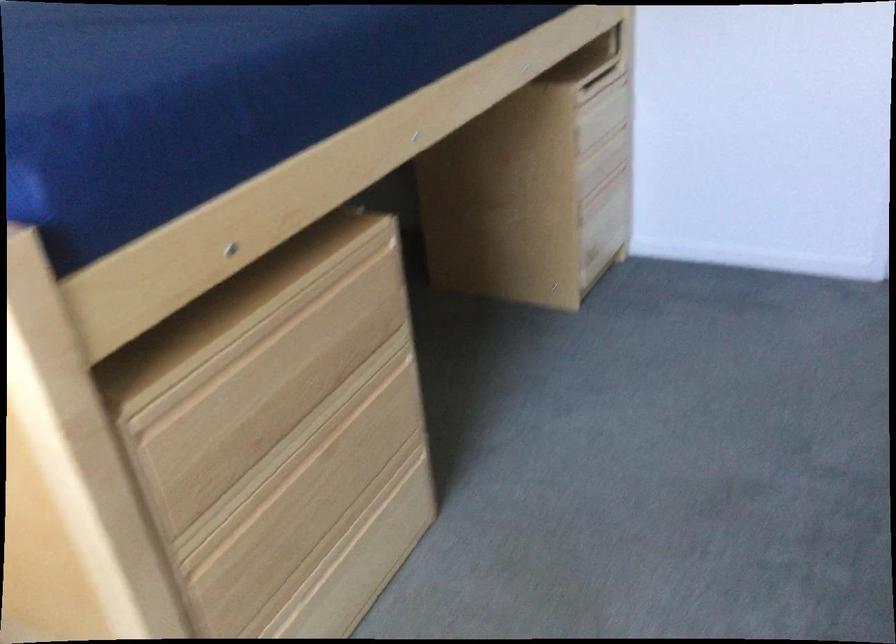
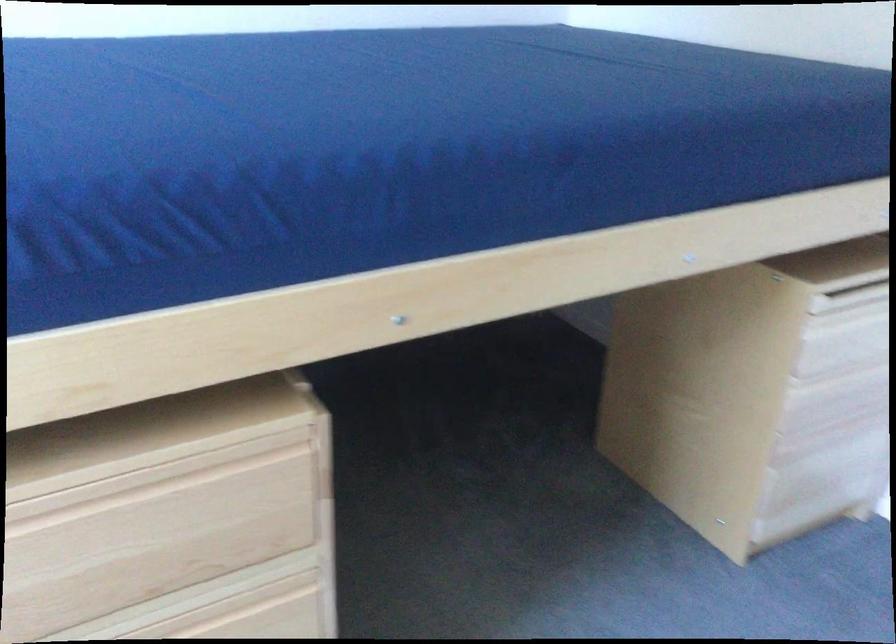
Where in the second image is the point corresponding to pixel 375 397 from the first image?

(253, 614)